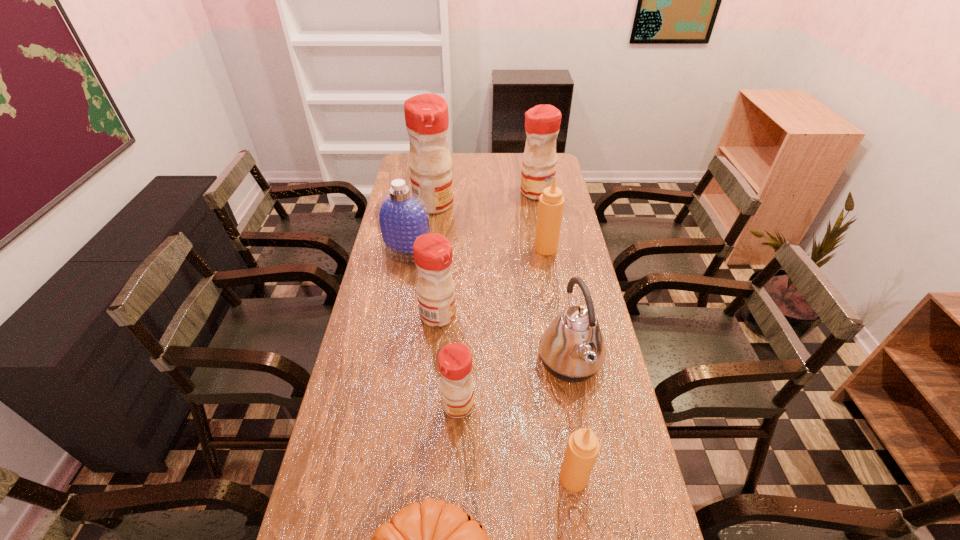
The height and width of the screenshot is (540, 960). Identify the location of vacant space located on the right of the nearest red condiment. (591, 405).

The height and width of the screenshot is (540, 960). Find the location of `free location located on the back of the nearer tan condiment`. free location located on the back of the nearer tan condiment is located at coordinates (560, 391).

In order to click on condiment located at the left edge in this screenshot , I will do `click(426, 115)`.

Locate an element on the screen. Image resolution: width=960 pixels, height=540 pixels. cleansing agent that is positioned at the left edge is located at coordinates (402, 216).

Locate an element on the screen. kettle that is at the right edge is located at coordinates (572, 348).

I want to click on vacant region at the far edge, so click(470, 160).

At what (x,y) coordinates should I click in order to perform the action: click on vacant space at the left edge of the desktop. Please return your answer as a coordinate pair (x, y). This screenshot has width=960, height=540. Looking at the image, I should click on (381, 252).

At what (x,y) coordinates should I click in order to perform the action: click on free space at the right edge of the desktop. Please return your answer as a coordinate pair (x, y). This screenshot has height=540, width=960. Looking at the image, I should click on (562, 254).

The width and height of the screenshot is (960, 540). I want to click on free space between the second nearest condiment and the second tallest object, so click(497, 299).

You are a GUI agent. You are given a task and a screenshot of the screen. Output one action in this format:
    pyautogui.click(x=<x>, y=<y>)
    Task: Click on the empty space between the biggest red condiment and the kettle
    This screenshot has height=540, width=960.
    Given the screenshot: What is the action you would take?
    pyautogui.click(x=502, y=283)